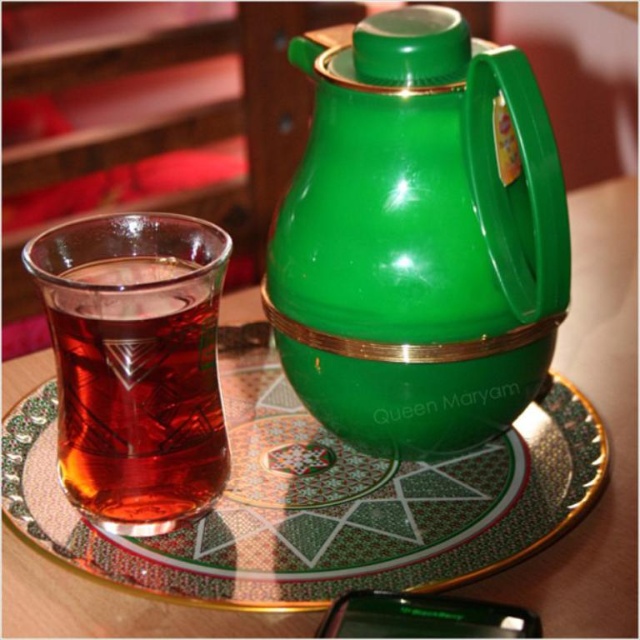
You are a tea lover who wants to pour tea from the green glossy thermos at center into the translucent glass cup at left. Can you do this without moving either object?

The green glossy thermos at center and translucent glass cup at left are 3.23 inches apart, so you can pour tea from the green glossy thermos at center into the translucent glass cup at left without moving either object since the distance is manageable for pouring.

You are standing in front of a traditional tea setup. There is a green glossy thermos at center and a glass of tea to its left. A small rectangular tag is attached to the thermos handle. If you were to place a new teacup at point coordinates (419, 237), where would it be placed relative to the green glossy thermos at center?

The point coordinates (419, 237) corresponds to the green glossy thermos at center, so placing the teacup there would put it directly on top of the thermos.

Consider the image. You are a guest at a tea ceremony and need to reach for the tea. Which object should you grab first, the green glossy plate at center or the translucent glass cup at left, and why?

You should grab the green glossy plate at center first because it is closer to you than the translucent glass cup at left, which is further away.